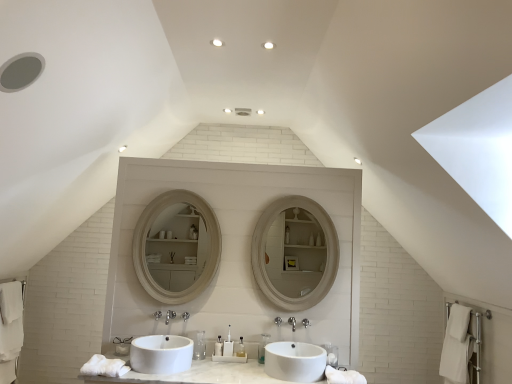
Question: Which direction should I rotate to look at polished chrome faucet at center, which is the second plumbing fixture from left to right, — up or down?

Choices:
 (A) down
 (B) up

Answer: (A)

Question: Would you say translucent plastic toothbrush at center, the second toiletry from the left, is outside polished chrome faucet at center, which is the second plumbing fixture from left to right?

Choices:
 (A) no
 (B) yes

Answer: (B)

Question: Is translucent plastic toothbrush at center, the second toiletry from the left, thinner than polished chrome faucet at center, acting as the 1th plumbing fixture starting from the right?

Choices:
 (A) no
 (B) yes

Answer: (B)

Question: From a real-world perspective, is translucent plastic toothbrush at center, the second toiletry from the left, located higher than polished chrome faucet at center, which is the second plumbing fixture from left to right?

Choices:
 (A) yes
 (B) no

Answer: (B)

Question: Does translucent plastic toothbrush at center, acting as the fifth toiletry starting from the right, have a greater width compared to polished chrome faucet at center, which is the second plumbing fixture from left to right?

Choices:
 (A) yes
 (B) no

Answer: (B)

Question: Are translucent plastic toothbrush at center, the second toiletry from the left, and polished chrome faucet at center, acting as the 1th plumbing fixture starting from the right, beside each other?

Choices:
 (A) no
 (B) yes

Answer: (A)

Question: Can you confirm if translucent plastic toothbrush at center, acting as the fifth toiletry starting from the right, is bigger than polished chrome faucet at center, acting as the 1th plumbing fixture starting from the right?

Choices:
 (A) yes
 (B) no

Answer: (A)

Question: Considering the relative sizes of translucent plastic toiletries at center, arranged as the fourth toiletry when viewed from the left, and white glossy sink at center, positioned as the first sink in left-to-right order, in the image provided, is translucent plastic toiletries at center, arranged as the fourth toiletry when viewed from the left, smaller than white glossy sink at center, positioned as the first sink in left-to-right order,?

Choices:
 (A) yes
 (B) no

Answer: (A)

Question: Considering the relative positions of translucent plastic toiletries at center, arranged as the fourth toiletry when viewed from the left, and white glossy sink at center, positioned as the first sink in left-to-right order, in the image provided, is translucent plastic toiletries at center, arranged as the fourth toiletry when viewed from the left, to the right of white glossy sink at center, positioned as the first sink in left-to-right order, from the viewer's perspective?

Choices:
 (A) yes
 (B) no

Answer: (A)

Question: Is translucent plastic toiletries at center, the third toiletry positioned from the right, positioned in front of white glossy sink at center, the second sink positioned from the right?

Choices:
 (A) yes
 (B) no

Answer: (B)

Question: Is translucent plastic toiletries at center, the third toiletry positioned from the right, oriented away from white glossy sink at center, the second sink positioned from the right?

Choices:
 (A) no
 (B) yes

Answer: (A)

Question: Does translucent plastic toiletries at center, the third toiletry positioned from the right, have a larger size compared to white glossy sink at center, the second sink positioned from the right?

Choices:
 (A) no
 (B) yes

Answer: (A)

Question: Is translucent plastic toiletries at center, the third toiletry positioned from the right, positioned behind white glossy sink at center, the second sink positioned from the right?

Choices:
 (A) no
 (B) yes

Answer: (B)

Question: Is translucent plastic toothbrush at center, the 1th toiletry in the right-to-left sequence, bigger than matte white mirror at center?

Choices:
 (A) yes
 (B) no

Answer: (B)